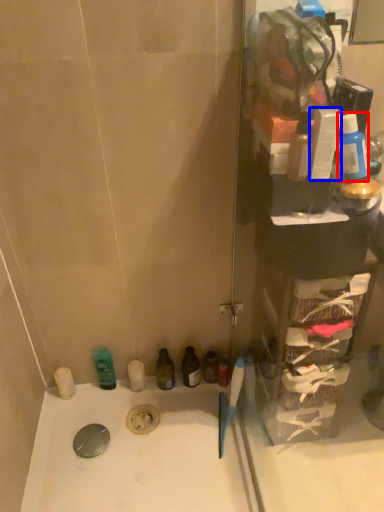
Question: Which of the following is the farthest to the observer, mouthwash (highlighted by a red box) or toiletry (highlighted by a blue box)?

Choices:
 (A) mouthwash
 (B) toiletry

Answer: (A)